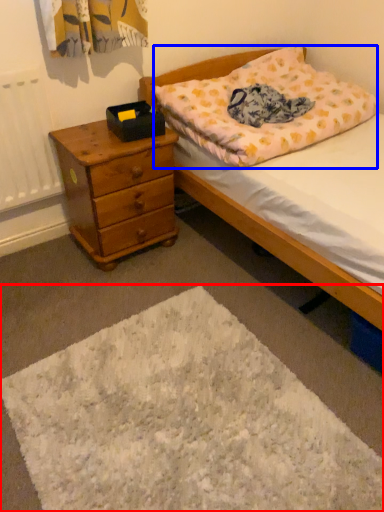
Question: Among these objects, which one is farthest to the camera, mat (highlighted by a red box) or pillow (highlighted by a blue box)?

Choices:
 (A) mat
 (B) pillow

Answer: (B)